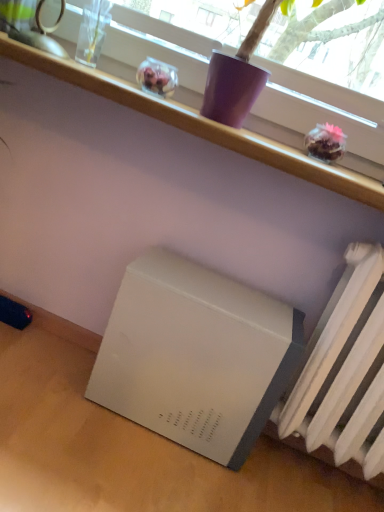
Where is `free area below white matte radiator at lower right (from a real-world perspective)`? free area below white matte radiator at lower right (from a real-world perspective) is located at coordinates (299, 477).